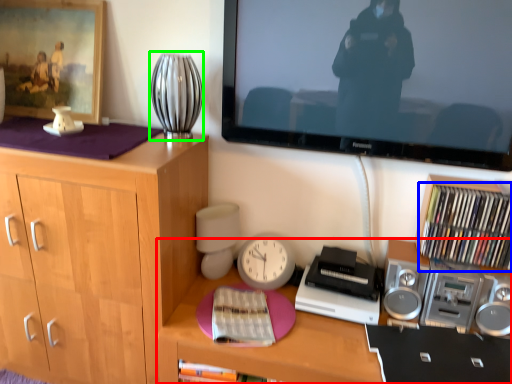
Question: Considering the real-world distances, which object is farthest from desk (highlighted by a red box)? book (highlighted by a blue box) or table lamp (highlighted by a green box)?

Choices:
 (A) book
 (B) table lamp

Answer: (B)